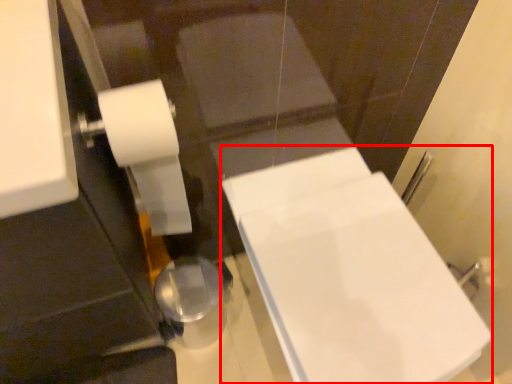
Question: Considering the relative positions of bath (annotated by the red box) and toilet paper in the image provided, where is bath (annotated by the red box) located with respect to the staircase?

Choices:
 (A) right
 (B) left

Answer: (A)